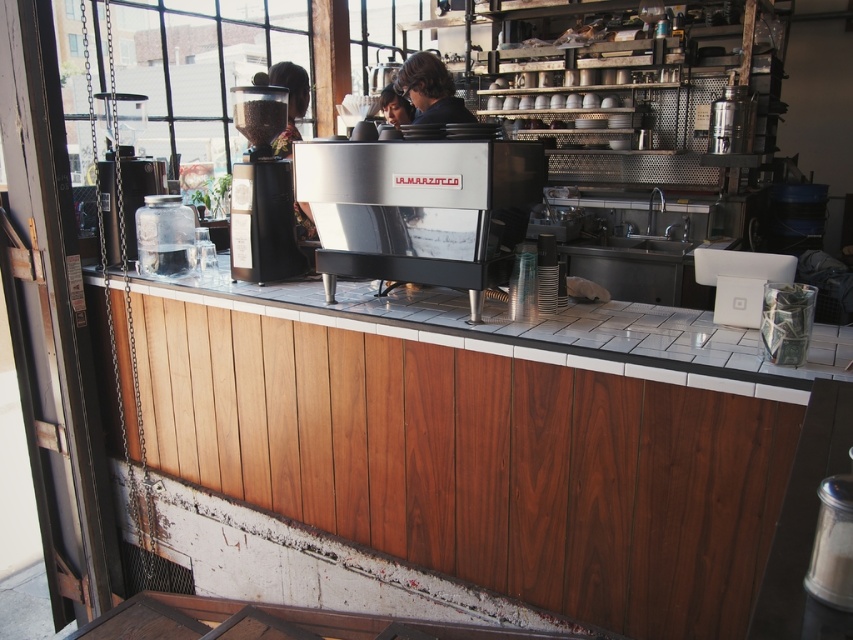
Question: Which point is farther to the camera?

Choices:
 (A) tap(824, 376)
 (B) tap(403, 186)
 (C) tap(463, 122)
 (D) tap(387, 120)

Answer: (D)

Question: Which object is the farthest from the dark brown hair at center?

Choices:
 (A) satin silver/brushed metal coffee machine at center
 (B) black plastic coffee grinder at center

Answer: (A)

Question: Based on their relative distances, which object is nearer to the transparent glass window at upper left?

Choices:
 (A) dark brown hair at center
 (B) white tile countertop at center

Answer: (A)

Question: Is white tile countertop at center closer to the viewer compared to satin silver/brushed metal coffee machine at center?

Choices:
 (A) yes
 (B) no

Answer: (A)

Question: From the image, what is the correct spatial relationship of black plastic coffee grinder at center in relation to transparent glass window at upper left?

Choices:
 (A) above
 (B) below

Answer: (B)

Question: Can you confirm if black plastic coffee grinder at center is positioned above transparent glass window at upper left?

Choices:
 (A) yes
 (B) no

Answer: (B)